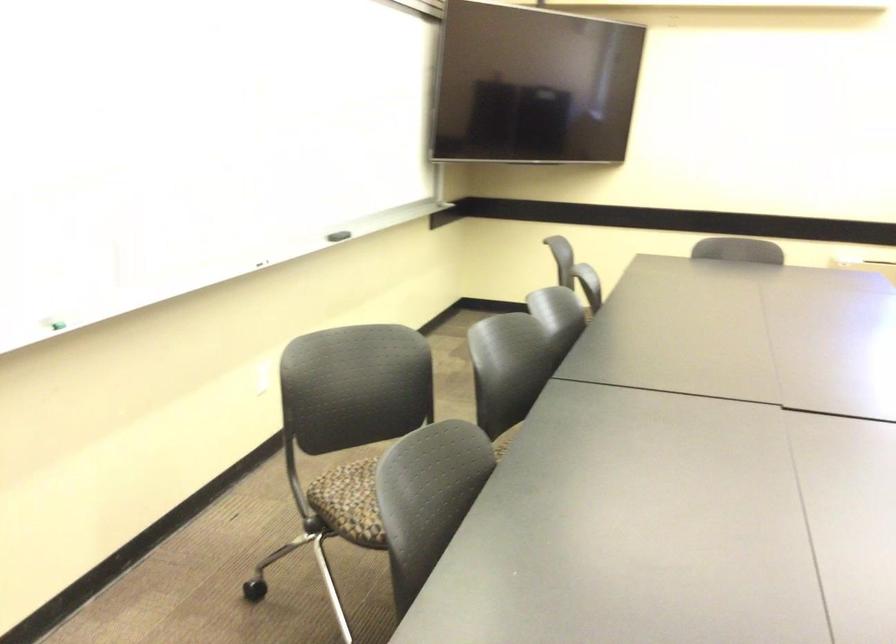
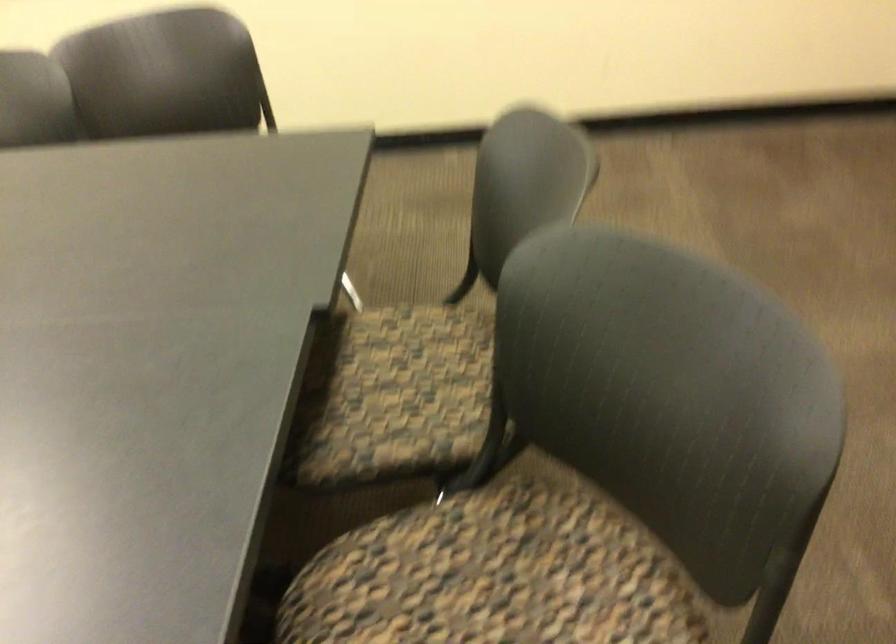
How did the camera likely rotate?

The camera's rotation is toward right-down.